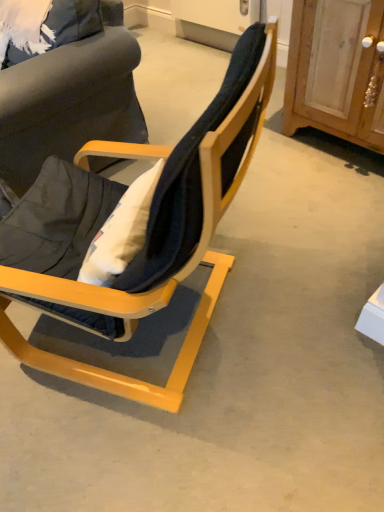
This screenshot has height=512, width=384. Identify the location of vacant point to the right of wooden rocking chair at center. (305, 283).